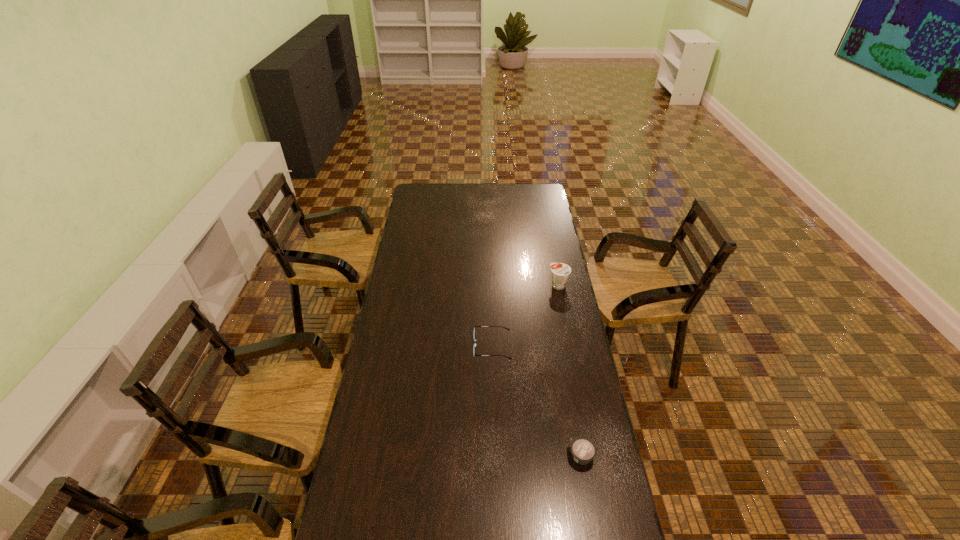
At what (x,y) coordinates should I click in order to perform the action: click on free location located 0.120m on the back of the nearest object. Please return your answer as a coordinate pair (x, y). Image resolution: width=960 pixels, height=540 pixels. Looking at the image, I should click on (573, 412).

In the image, there is a desktop. Where is `vacant space at the far edge`? Image resolution: width=960 pixels, height=540 pixels. vacant space at the far edge is located at coordinates (458, 204).

At what (x,y) coordinates should I click in order to perform the action: click on free space at the left edge. Please return your answer as a coordinate pair (x, y). Image resolution: width=960 pixels, height=540 pixels. Looking at the image, I should click on (435, 210).

Find the location of a particular element. free space at the right edge of the desktop is located at coordinates (564, 258).

You are a GUI agent. You are given a task and a screenshot of the screen. Output one action in this format:
    pyautogui.click(x=<x>, y=<y>)
    Task: Click on the free region at the far left corner
    This screenshot has height=540, width=960.
    Given the screenshot: What is the action you would take?
    pyautogui.click(x=420, y=198)

Where is `vacant point located between the nearer yogurt and the tallest object`? vacant point located between the nearer yogurt and the tallest object is located at coordinates (570, 371).

You are a GUI agent. You are given a task and a screenshot of the screen. Output one action in this format:
    pyautogui.click(x=<x>, y=<y>)
    Task: Click on the unoccupied position between the second farthest object and the taller yogurt
    The image size is (960, 540).
    Given the screenshot: What is the action you would take?
    pyautogui.click(x=525, y=316)

At what (x,y) coordinates should I click in order to perform the action: click on empty location between the spectacles and the nearest object. Please return your answer as a coordinate pair (x, y). Looking at the image, I should click on (537, 401).

Find the location of a particular element. unoccupied position between the tallest object and the nearest object is located at coordinates (570, 371).

Locate an element on the screen. free space that is in between the leftmost object and the taller yogurt is located at coordinates (525, 316).